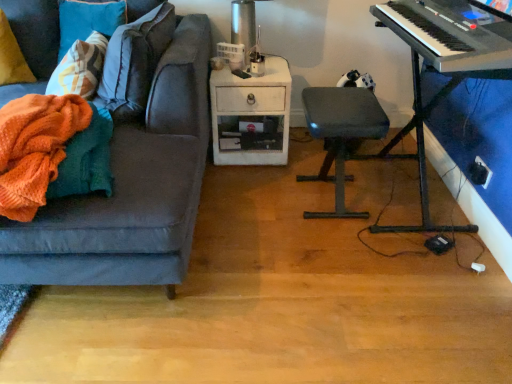
Identify the location of black plastic keyboard at upper right. This screenshot has height=384, width=512. (450, 33).

Measure the distance between point (465, 73) and camera.

Point (465, 73) is 4.51 feet from camera.

In order to face matte gray stool at center, should I rotate leftwards or rightwards?

Rotate right and turn 10.243 degrees.

What is the approximate width of yellow fabric pillow at left?

yellow fabric pillow at left is 32.64 centimeters in width.

Locate an element on the screen. orange knitted blanket at left is located at coordinates (35, 148).

What is the approximate height of metallic silver table lamp at upper center?

It is 35.05 centimeters.

What do you see at coordinates (243, 26) in the screenshot? This screenshot has height=384, width=512. I see `metallic silver table lamp at upper center` at bounding box center [243, 26].

Locate an element on the screen. The image size is (512, 384). black plastic keyboard at upper right is located at coordinates (450, 33).

Considering the sizes of objects yellow fabric pillow at left and white wicker side table at center in the image provided, who is thinner, yellow fabric pillow at left or white wicker side table at center?

yellow fabric pillow at left is thinner.

From a real-world perspective, is yellow fabric pillow at left on white wicker side table at center?

Yes, from a real-world perspective, yellow fabric pillow at left is over white wicker side table at center

From the picture: From the image's perspective, which one is positioned higher, yellow fabric pillow at left or white wicker side table at center?

yellow fabric pillow at left.

Is white wicker side table at center inside orange knitted blanket at left?

Definitely not — white wicker side table at center is not inside orange knitted blanket at left.

Can you confirm if orange knitted blanket at left is shorter than white wicker side table at center?

Yes, orange knitted blanket at left is shorter than white wicker side table at center.

Which object is thinner, orange knitted blanket at left or white wicker side table at center?

With smaller width is orange knitted blanket at left.

Locate an element on the screen. The image size is (512, 384). blanket on the left of white wicker side table at center is located at coordinates tap(35, 148).

Consider the image. Considering the positions of objects black plastic keyboard at upper right and metallic silver table lamp at upper center in the image provided, who is in front, black plastic keyboard at upper right or metallic silver table lamp at upper center?

black plastic keyboard at upper right is closer to the camera.

From a real-world perspective, is black plastic keyboard at upper right below metallic silver table lamp at upper center?

Incorrect, from a real-world perspective, black plastic keyboard at upper right is higher than metallic silver table lamp at upper center.

This screenshot has width=512, height=384. Find the location of `table lamp that is on the left side of black plastic keyboard at upper right`. table lamp that is on the left side of black plastic keyboard at upper right is located at coordinates (243, 26).

Considering the points (459, 1) and (233, 1), which point is in front, point (459, 1) or point (233, 1)?

The point (459, 1) is in front.

From the image's perspective, is metallic silver table lamp at upper center located above orange knitted blanket at left?

Yes.

Is metallic silver table lamp at upper center positioned in front of orange knitted blanket at left?

No, it is not.

Between metallic silver table lamp at upper center and orange knitted blanket at left, which one has larger size?

metallic silver table lamp at upper center is bigger.

Does point (424, 219) lie behind point (247, 24)?

No, it is in front of (247, 24).

Looking at the image, does black plastic keyboard at right seem bigger or smaller compared to metallic silver table lamp at upper center?

Considering their sizes, black plastic keyboard at right takes up more space than metallic silver table lamp at upper center.

Looking at this image, can you confirm if black plastic keyboard at right is thinner than metallic silver table lamp at upper center?

No.

At what (x,y) coordinates should I click in order to perform the action: click on piano lying on the right of metallic silver table lamp at upper center. Please return your answer as a coordinate pair (x, y). This screenshot has height=384, width=512. Looking at the image, I should click on (445, 64).

Would you consider metallic silver table lamp at upper center to be distant from yellow fabric pillow at left?

Yes, metallic silver table lamp at upper center and yellow fabric pillow at left are located far from each other.

From a real-world perspective, is metallic silver table lamp at upper center physically located above or below yellow fabric pillow at left?

metallic silver table lamp at upper center is above yellow fabric pillow at left.

Which of these two, metallic silver table lamp at upper center or yellow fabric pillow at left, is smaller?

yellow fabric pillow at left.

Can you confirm if metallic silver table lamp at upper center is shorter than yellow fabric pillow at left?

Correct, metallic silver table lamp at upper center is not as tall as yellow fabric pillow at left.

Find the location of a particular element. The width and height of the screenshot is (512, 384). blanket in front of the black plastic keyboard at right is located at coordinates (35, 148).

How many degrees apart are the facing directions of black plastic keyboard at right and orange knitted blanket at left?

The angle between the facing direction of black plastic keyboard at right and the facing direction of orange knitted blanket at left is 3.15 degrees.

Looking at this image, considering the sizes of objects black plastic keyboard at right and orange knitted blanket at left in the image provided, who is smaller, black plastic keyboard at right or orange knitted blanket at left?

Smaller between the two is orange knitted blanket at left.

From the image's perspective, which one is positioned higher, black plastic keyboard at right or orange knitted blanket at left?

black plastic keyboard at right.

I want to click on pillow above the white wicker side table at center (from the image's perspective), so click(x=12, y=57).

In order to click on table behind the orange knitted blanket at left in this screenshot , I will do `click(251, 116)`.

From the image, which object appears to be farther from matte gray stool at center, orange knitted blanket at left or black plastic keyboard at right?

orange knitted blanket at left lies further to matte gray stool at center than the other object.

From the image, which object appears to be farther from yellow fabric pillow at left, white wicker side table at center or black plastic keyboard at upper right?

black plastic keyboard at upper right is further to yellow fabric pillow at left.

Estimate the real-world distances between objects in this image. Which object is further from black plastic keyboard at right, white wicker side table at center or matte gray stool at center?

white wicker side table at center is further to black plastic keyboard at right.

From the image, which object appears to be farther from yellow fabric pillow at left, matte gray stool at center or black plastic keyboard at upper right?

black plastic keyboard at upper right is further to yellow fabric pillow at left.

Consider the image. Estimate the real-world distances between objects in this image. Which object is further from matte gray stool at center, black plastic keyboard at upper right or black plastic keyboard at right?

Among the two, black plastic keyboard at upper right is located further to matte gray stool at center.

Based on their spatial positions, is orange knitted blanket at left or metallic silver table lamp at upper center further from white wicker side table at center?

orange knitted blanket at left lies further to white wicker side table at center than the other object.

Looking at the image, which one is located further to orange knitted blanket at left, black plastic keyboard at right or yellow fabric pillow at left?

Based on the image, black plastic keyboard at right appears to be further to orange knitted blanket at left.

When comparing their distances from matte gray stool at center, does white wicker side table at center or metallic silver table lamp at upper center seem closer?

Based on the image, white wicker side table at center appears to be nearer to matte gray stool at center.

Where is `table between metallic silver table lamp at upper center and matte gray stool at center in the vertical direction`? This screenshot has height=384, width=512. table between metallic silver table lamp at upper center and matte gray stool at center in the vertical direction is located at coordinates (251, 116).

I want to click on piano between orange knitted blanket at left and black plastic keyboard at upper right, so [x=445, y=64].

Identify the location of blanket located between yellow fabric pillow at left and black plastic keyboard at upper right in the left-right direction. The image size is (512, 384). (35, 148).

Identify the location of piano situated between yellow fabric pillow at left and black plastic keyboard at upper right from left to right. (445, 64).